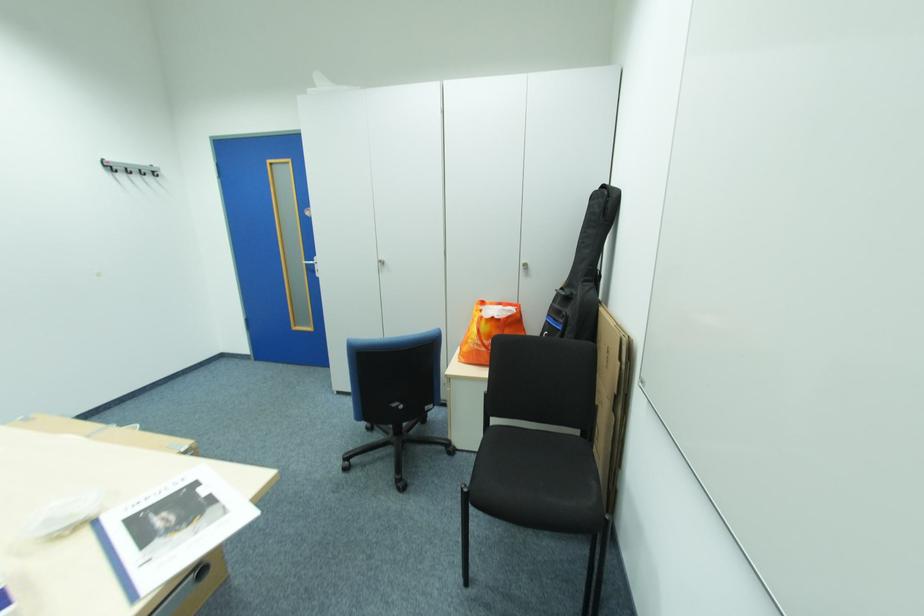
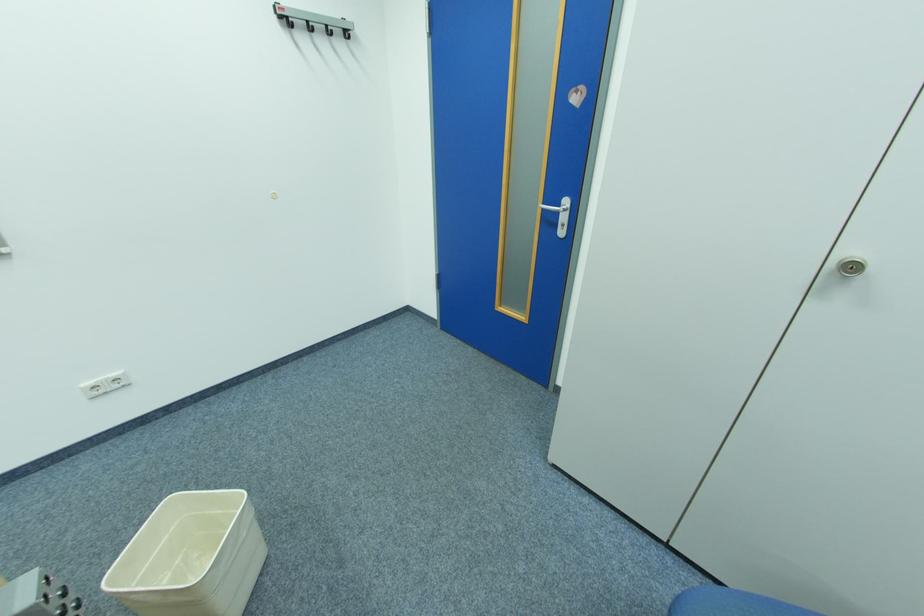
Locate, in the second image, the point that corresponds to point (114, 171) in the first image.

(290, 25)